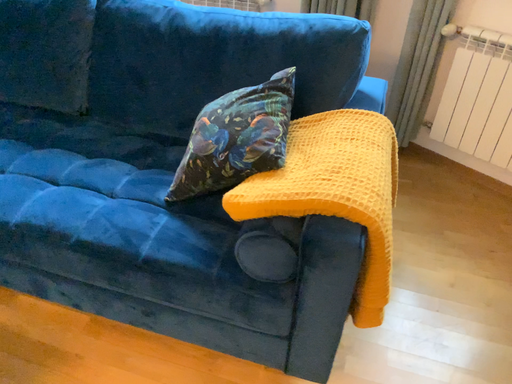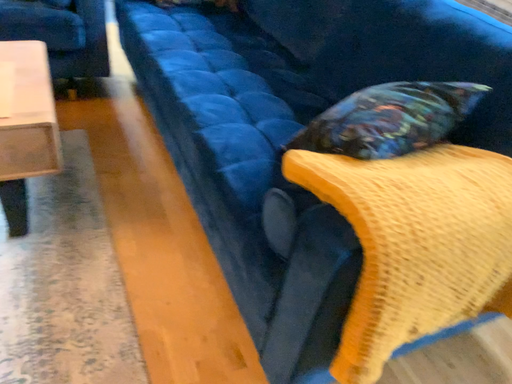
Question: Which way did the camera rotate in the video?

Choices:
 (A) rotated left
 (B) rotated right

Answer: (A)